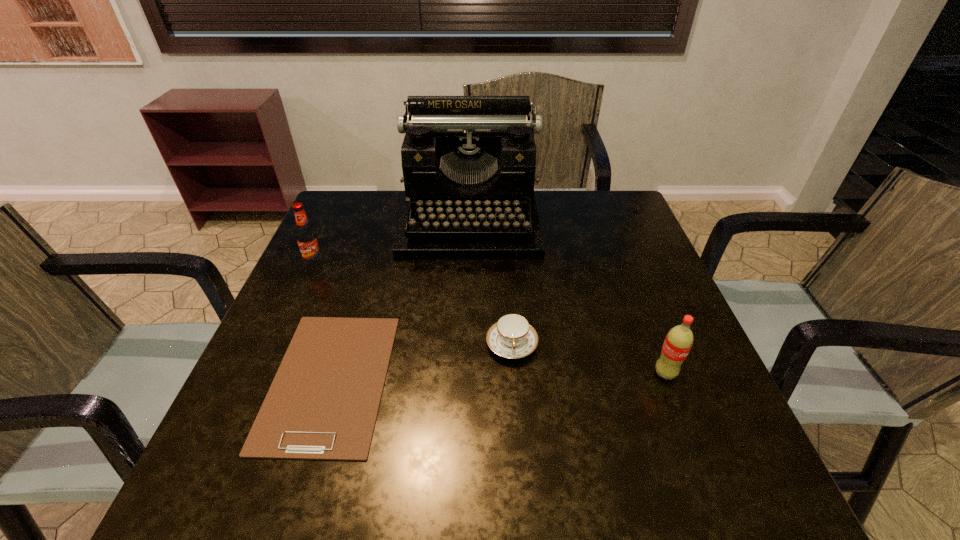
The image size is (960, 540). I want to click on vacant area at the right edge of the desktop, so click(650, 248).

This screenshot has width=960, height=540. I want to click on vacant space at the far left corner of the desktop, so click(x=344, y=199).

You are a GUI agent. You are given a task and a screenshot of the screen. Output one action in this format:
    pyautogui.click(x=<x>, y=<y>)
    Task: Click on the free location at the near left corner of the desktop
    
    Given the screenshot: What is the action you would take?
    pyautogui.click(x=230, y=504)

Identify the location of vacant space at the far right corner. (586, 224).

I want to click on vacant area that lies between the typewriter and the fourth tallest object, so click(491, 282).

Locate an element on the screen. This screenshot has height=540, width=960. free spot between the second shortest object and the root beer is located at coordinates (414, 304).

Identify the location of unoccupied area between the teacup and the rightmost object. Image resolution: width=960 pixels, height=540 pixels. (588, 359).

What are the coordinates of `free space between the teacup and the tallest object` in the screenshot? It's located at (491, 282).

Where is `free spot between the farthest object and the second shortest object`? This screenshot has height=540, width=960. free spot between the farthest object and the second shortest object is located at coordinates (491, 282).

Where is `vacant region between the fourth tallest object and the root beer`? The image size is (960, 540). vacant region between the fourth tallest object and the root beer is located at coordinates (414, 304).